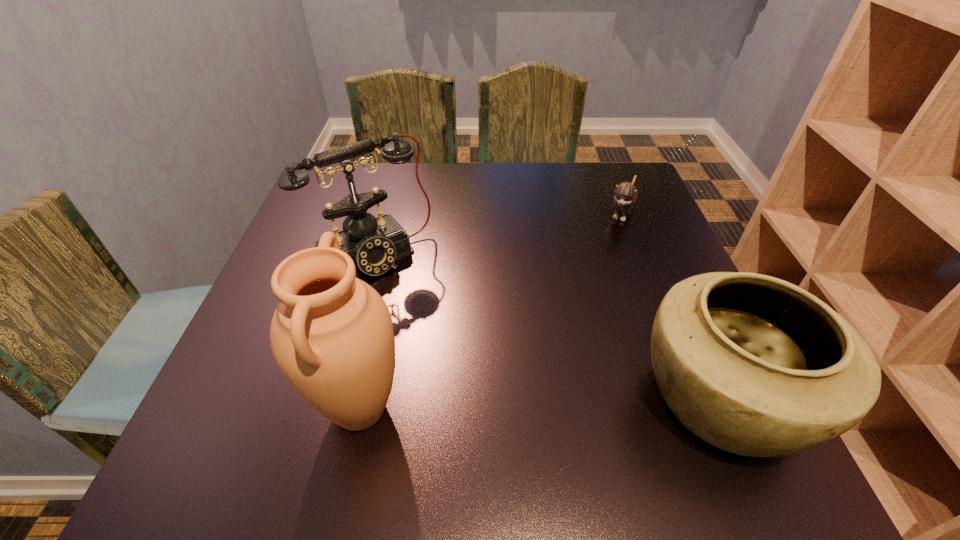
Find the location of `vacant area that lies between the urn and the kitten`. vacant area that lies between the urn and the kitten is located at coordinates (491, 311).

Select which object is the closest to the shortest object. Please provide its 2D coordinates. Your answer should be formatted as a tuple, i.e. [(x, y)], where the tuple contains the x and y coordinates of a point satisfying the conditions above.

[(754, 365)]

The height and width of the screenshot is (540, 960). I want to click on object that stands as the third closest to the shortest object, so click(332, 336).

I want to click on vacant space that satisfies the following two spatial constraints: 1. on the front side of the kitten; 2. on the left side of the second shortest object, so click(692, 397).

Find the location of a particular element. free region that satisfies the following two spatial constraints: 1. on the back side of the telephone; 2. on the left side of the shortest object is located at coordinates (386, 213).